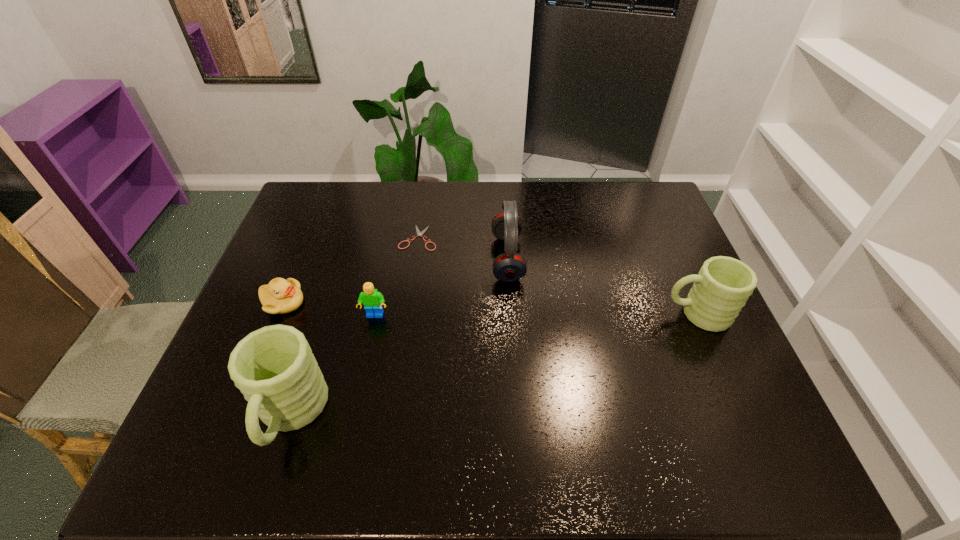
At what (x,y) coordinates should I click in order to perform the action: click on free region located on the side of the shorter mug with the handle. Please return your answer as a coordinate pair (x, y). Image resolution: width=960 pixels, height=540 pixels. Looking at the image, I should click on (514, 314).

Where is `vacant space located 0.100m on the ear cups of the earphone`? The image size is (960, 540). vacant space located 0.100m on the ear cups of the earphone is located at coordinates (459, 259).

Locate an element on the screen. free region located 0.210m on the ear cups of the earphone is located at coordinates (422, 259).

At what (x,y) coordinates should I click in order to perform the action: click on vacant space located on the ear cups of the earphone. Please return your answer as a coordinate pair (x, y). Image resolution: width=960 pixels, height=540 pixels. Looking at the image, I should click on (409, 259).

What are the coordinates of `vacant space situated 0.100m on the front of the shortest object` in the screenshot? It's located at (413, 274).

This screenshot has width=960, height=540. I want to click on vacant space located at the face of the duckling, so click(x=355, y=302).

You are a GUI agent. You are given a task and a screenshot of the screen. Output one action in this format:
    pyautogui.click(x=<x>, y=<y>)
    Task: Click on the vacant position located on the face of the third shortest object
    The width and height of the screenshot is (960, 540).
    Given the screenshot: What is the action you would take?
    pyautogui.click(x=366, y=359)

Where is `object that is at the near edge`? This screenshot has width=960, height=540. object that is at the near edge is located at coordinates (274, 367).

You are a GUI agent. You are given a task and a screenshot of the screen. Output one action in this format:
    pyautogui.click(x=<x>, y=<y>)
    Task: Click on the mug situated at the left edge
    
    Given the screenshot: What is the action you would take?
    pyautogui.click(x=274, y=367)

Where is `duckling located at the left edge`? This screenshot has width=960, height=540. duckling located at the left edge is located at coordinates (280, 296).